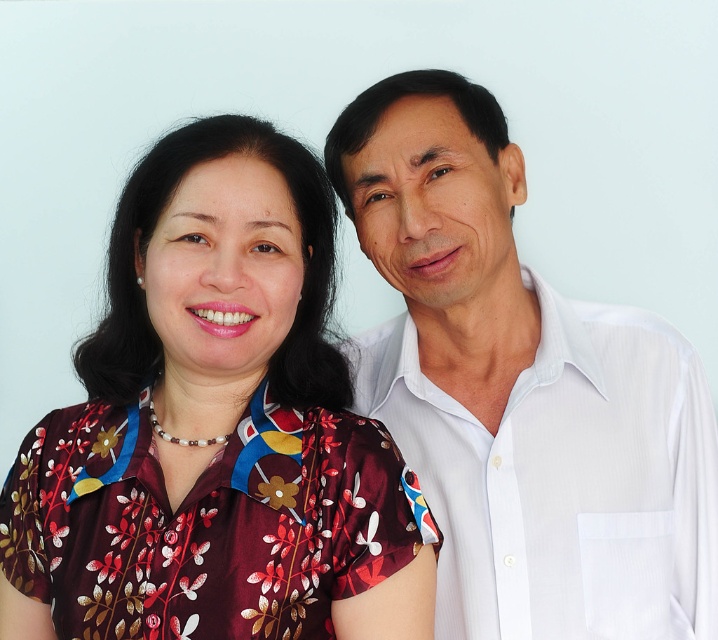
You are a photographer setting up for a portrait shoot. The subjects are wearing a floral silk blouse at center and a white smooth shirt at right. You need to ensure there is at least 10 inches of space between them to avoid overlapping in the frame. Based on the scene description, is the current distance sufficient?

The floral silk blouse at center and white smooth shirt at right are 9.70 inches apart from each other, which is less than the required 10 inches. Therefore, the current distance is not sufficient to avoid overlapping in the frame.

You are a fashion stylist trying to pair outfits for a client. The client has a floral silk blouse at center and a white smooth shirt at right. Which item should they choose if they want something that is not too large for their petite frame?

The floral silk blouse at center has a smaller size compared to the white smooth shirt at right, so the client should choose the floral silk blouse at center for a more petite frame.

You are a tailor measuring clothing for a customer. You need to determine which garment has a larger width measurement between the floral silk blouse at center and the white smooth shirt at right. Based on the image, which one is wider?

The floral silk blouse at center is wider than the white smooth shirt at right, as stated in the description that its width surpasses the shirt.